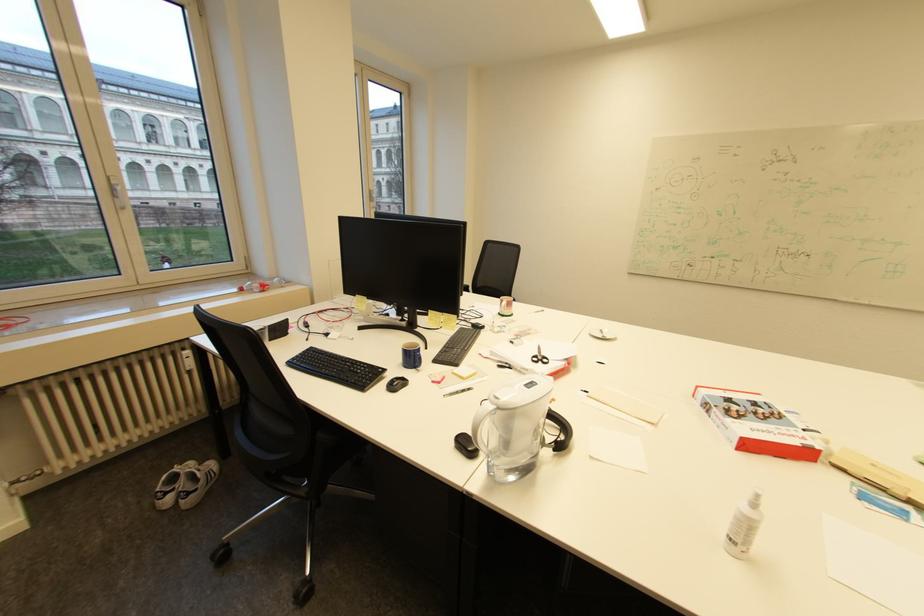
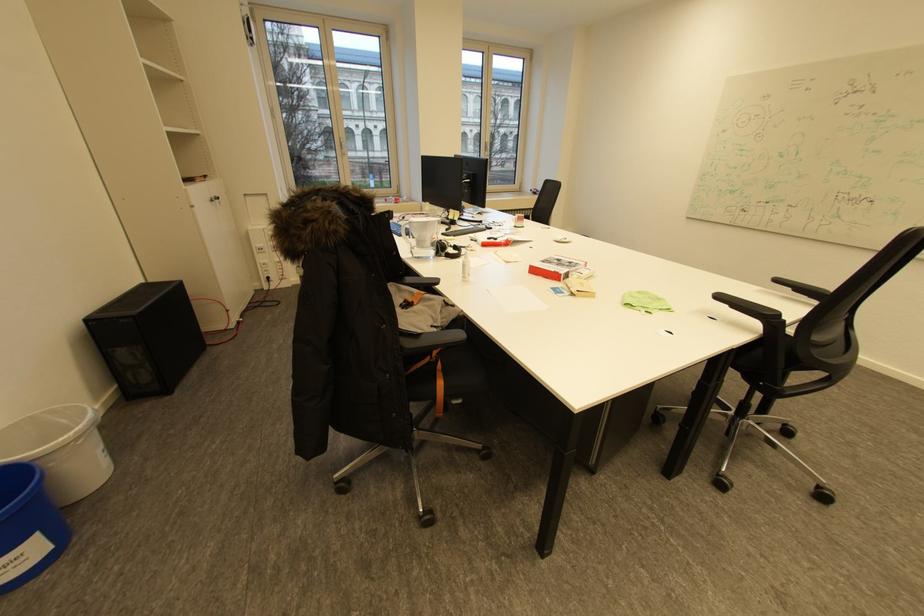
In the second image, find the point that corresponds to point (761, 405) in the first image.

(576, 262)